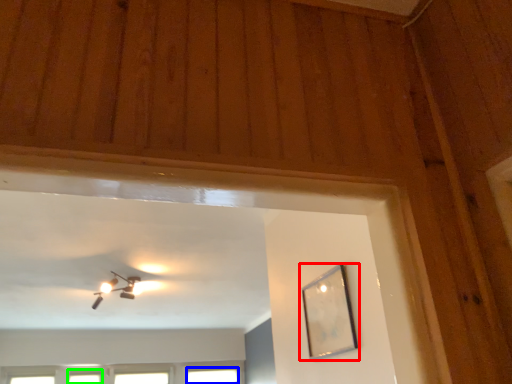
Question: Estimate the real-world distances between objects in this image. Which object is closer to picture frame (highlighted by a red box), window (highlighted by a blue box) or window (highlighted by a green box)?

Choices:
 (A) window
 (B) window

Answer: (A)